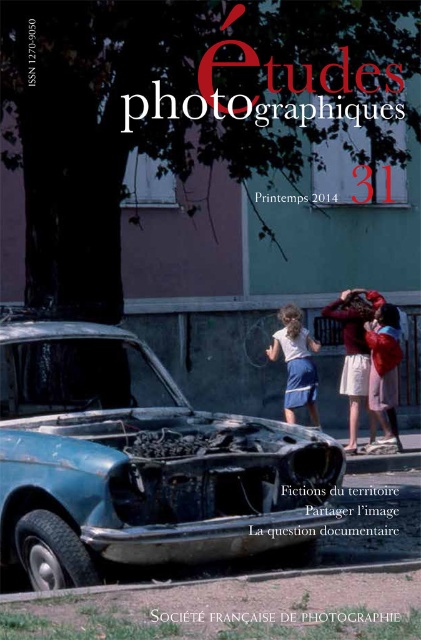
Does pink fabric dress at center have a larger size compared to matte white shirt at center?

Indeed, pink fabric dress at center has a larger size compared to matte white shirt at center.

Which is more to the right, pink fabric dress at center or matte white shirt at center?

From the viewer's perspective, pink fabric dress at center appears more on the right side.

Identify the location of pink fabric dress at center. 354,349.

Does matte red jacket at center appear over matte white shirt at center?

Incorrect, matte red jacket at center is not positioned above matte white shirt at center.

Who is more distant from viewer, (365, 326) or (285, 394)?

Positioned behind is point (285, 394).

Where is `matte red jacket at center`? The image size is (421, 640). matte red jacket at center is located at coordinates (383, 371).

Is point (181, 456) more distant than point (308, 390)?

No, (181, 456) is in front of (308, 390).

Who is more forward, (63, 330) or (296, 330)?

Positioned in front is point (63, 330).

Locate an element on the screen. The width and height of the screenshot is (421, 640). blue metallic car at lower left is located at coordinates (140, 461).